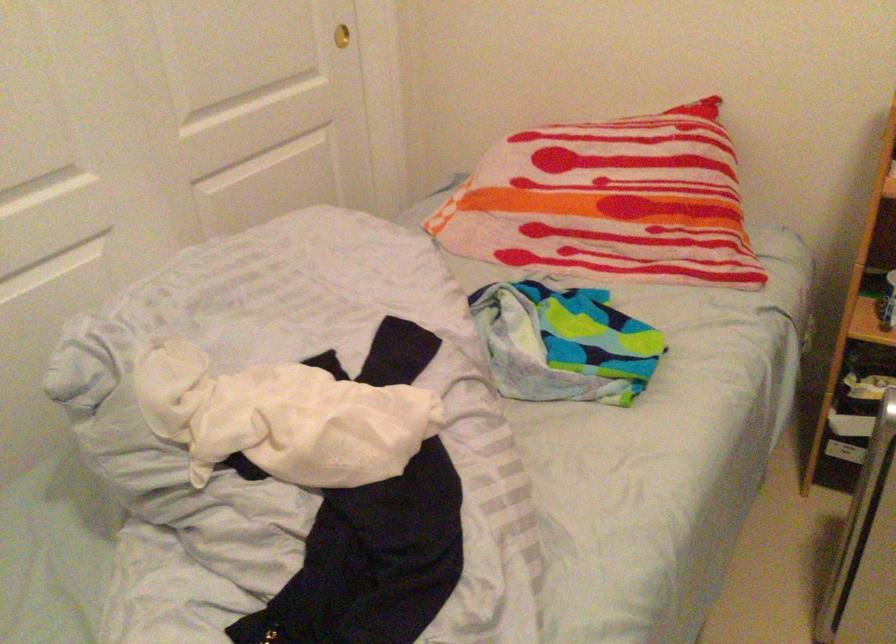
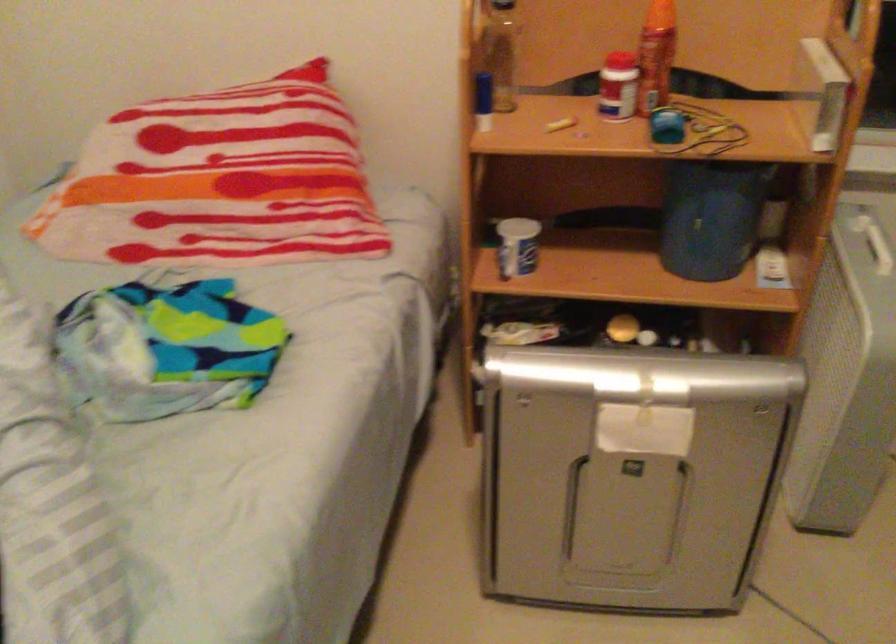
Question: In a continuous first-person perspective shot, in which direction is the camera moving?

Choices:
 (A) Left
 (B) Right
 (C) Forward
 (D) Backward

Answer: (B)